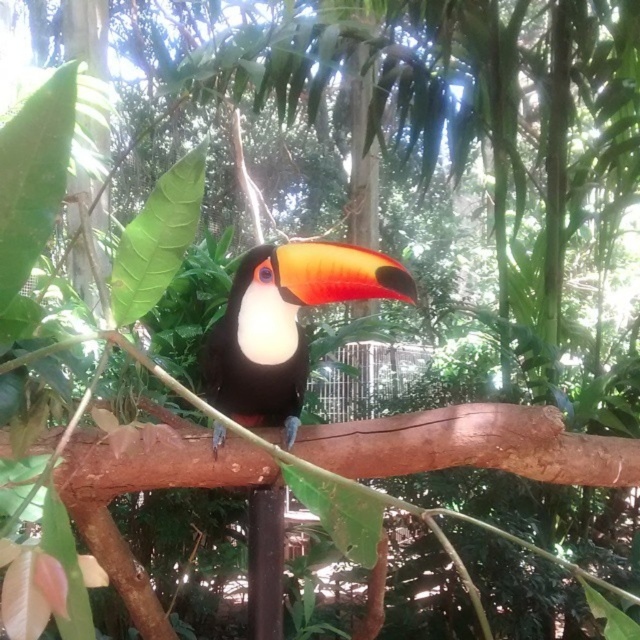
Who is taller, brown rough tree branch at center or shiny black toucan at center?

shiny black toucan at center is taller.

Based on the photo, can you confirm if brown rough tree branch at center is bigger than shiny black toucan at center?

Correct, brown rough tree branch at center is larger in size than shiny black toucan at center.

Which is behind, point (413, 461) or point (237, 392)?

Positioned behind is point (237, 392).

Where is `brown rough tree branch at center`? The height and width of the screenshot is (640, 640). brown rough tree branch at center is located at coordinates (472, 445).